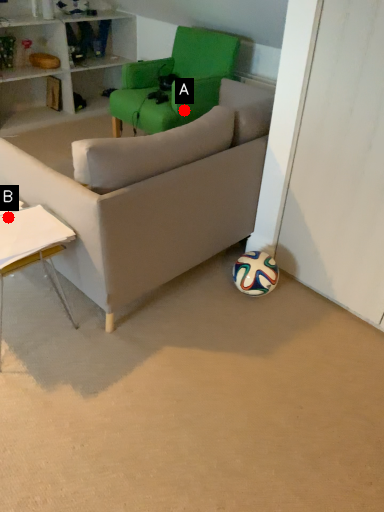
Question: Two points are circled on the image, labeled by A and B beside each circle. Which point is closer to the camera?

Choices:
 (A) A is closer
 (B) B is closer

Answer: (B)